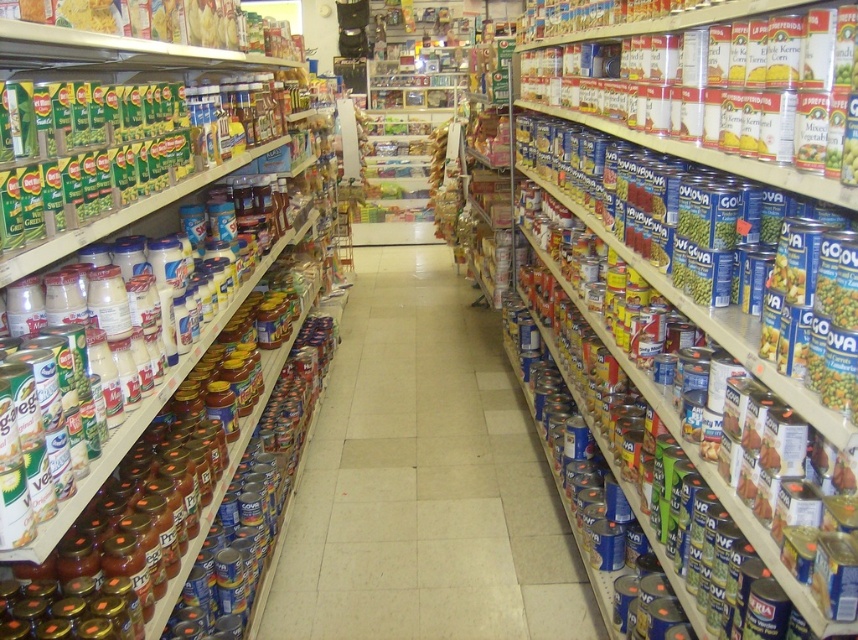
You are a store employee who needs to place a new label on the shelf next to the metallic cans at left. According to the store layout, where should you place the label in terms of coordinates?

The label should be placed at the coordinates corresponding to the metallic cans at left, which are located at point (146, 337).

You are standing in the grocery store aisle looking at the canned goods and jars. There are two points marked on the shelves. The first point is at coordinate point(4, 618) and the second is at point(388, 497). Which point is closer to you?

Point(4, 618) is closer to the camera than point(388, 497).

You are a grocery store employee who needs to restock the shelves. You have a new shipment of jars that need to be placed between the metallic cans at left and the metallic cans at center. Based on the current arrangement, where should you position the jars?

The metallic cans at left are to the left of the metallic cans at center, so you should place the jars between them in the space between the metallic cans at left and the metallic cans at center.